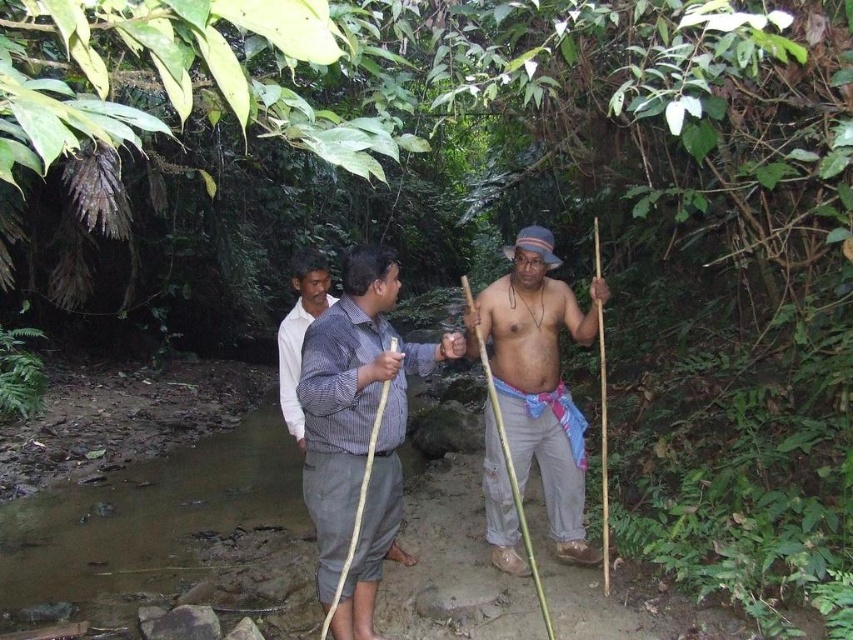
Does checkered fabric shirt at center have a greater width compared to matte brown stick at center?

Incorrect, checkered fabric shirt at center's width does not surpass matte brown stick at center's.

Does checkered fabric shirt at center appear on the left side of matte brown stick at center?

Indeed, checkered fabric shirt at center is positioned on the left side of matte brown stick at center.

Between point (369, 296) and point (529, 240), which one is positioned behind?

Point (529, 240)

This screenshot has height=640, width=853. Find the location of `checkered fabric shirt at center`. checkered fabric shirt at center is located at coordinates (357, 429).